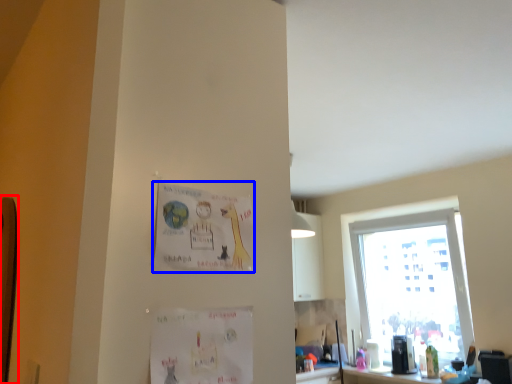
Question: Which object appears closest to the camera in this image, bulletin board (highlighted by a red box) or postcard (highlighted by a blue box)?

Choices:
 (A) bulletin board
 (B) postcard

Answer: (B)